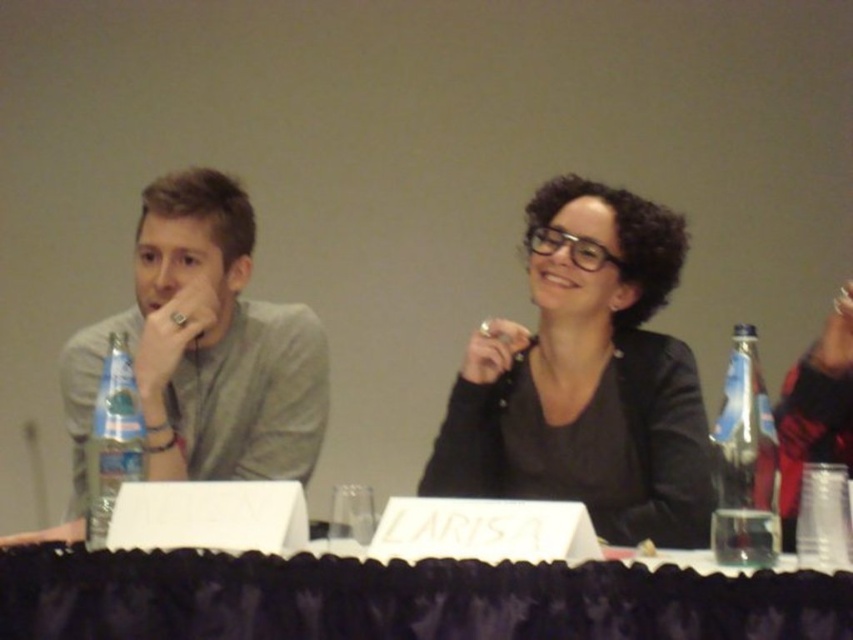
You are organizing a conference and need to place a 30 cm wide decorative centerpiece between the black matte jacket at center and the clear plastic bottle at left. Can the space accommodate it?

The black matte jacket at center is 77.86 centimeters away from the clear plastic bottle at left. Since the distance between them is greater than 30 centimeters, the space can accommodate the 30 cm wide decorative centerpiece.

You are organizing a small event and need to place a decorative centerpiece on the table. Given the current setup, can the black satin tablecloth at lower center accommodate the clear plastic bottle at right without moving other items?

The black satin tablecloth at lower center has a larger size compared to the clear plastic bottle at right, so it can accommodate the bottle without moving other items.

You are standing in front of the table and want to place a small object on the table. You have two options for placement based on the coordinates given. Which coordinate point, point (741, 600) or point (744, 419), is closer to you?

Point (741, 600) is closer to the viewer than point (744, 419). Therefore, placing the object at point (741, 600) would be closer to you.